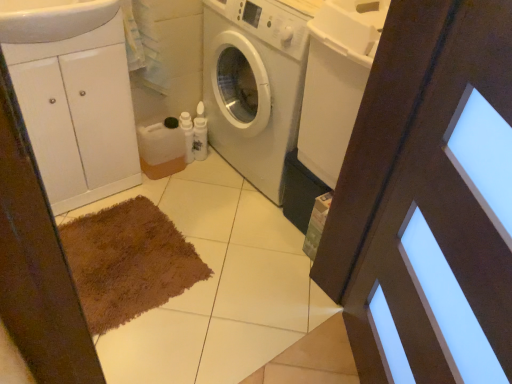
Question: Is white glossy sink at upper left inside the boundaries of white matte washing machine at center, or outside?

Choices:
 (A) inside
 (B) outside

Answer: (B)

Question: Considering the positions of white glossy sink at upper left and white matte washing machine at center in the image, is white glossy sink at upper left bigger or smaller than white matte washing machine at center?

Choices:
 (A) small
 (B) big

Answer: (A)

Question: Which of these objects is positioned closest to the brown wooden screen door at center?

Choices:
 (A) white glossy sink at upper left
 (B) white matte washing machine at center
 (C) white glossy cabinet at left

Answer: (B)

Question: Considering the real-world distances, which object is farthest from the brown wooden screen door at center?

Choices:
 (A) white glossy cabinet at left
 (B) white matte washing machine at center
 (C) white glossy sink at upper left

Answer: (C)